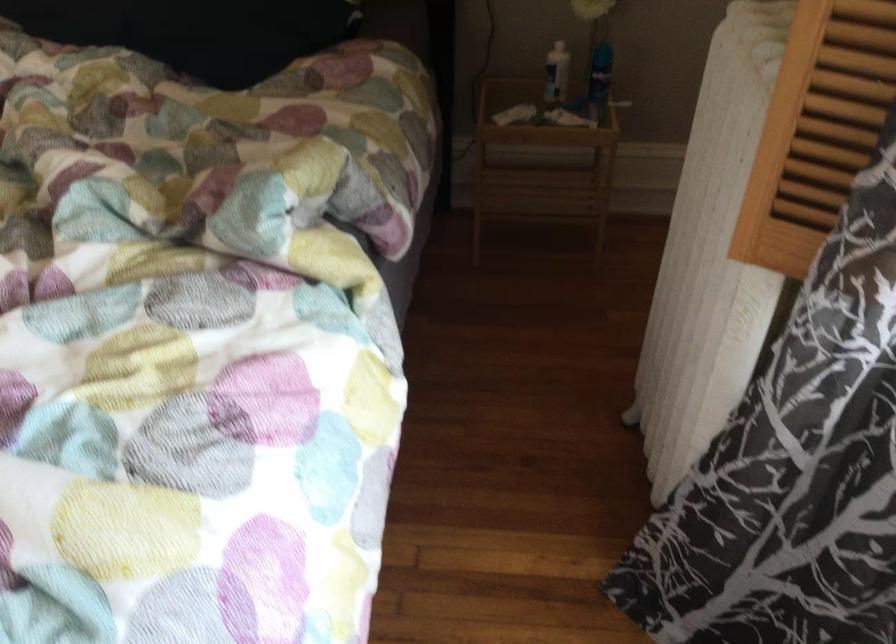
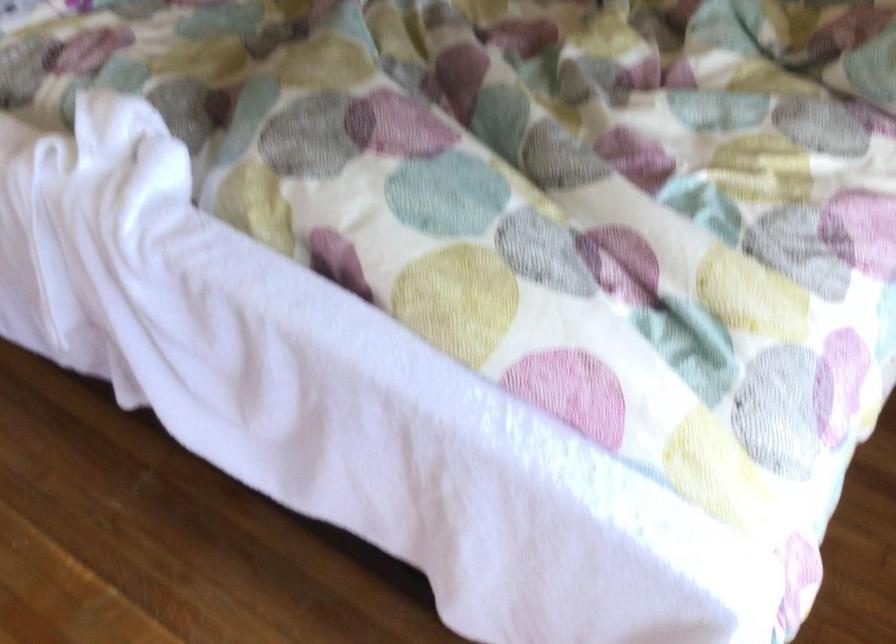
Question: The camera is either moving clockwise (left) or counter-clockwise (right) around the object. The first image is from the beginning of the video and the second image is from the end. Is the camera moving left or right when shooting the video?

Choices:
 (A) Left
 (B) Right

Answer: (B)